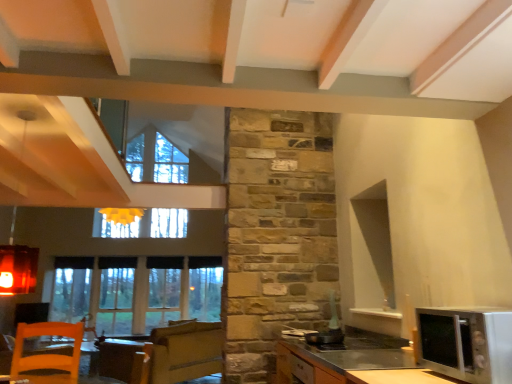
Question: Is satin silver microwave at lower right located within silver metallic microwave at lower right?

Choices:
 (A) no
 (B) yes

Answer: (A)

Question: Considering the relative sizes of silver metallic microwave at lower right and satin silver microwave at lower right in the image provided, is silver metallic microwave at lower right shorter than satin silver microwave at lower right?

Choices:
 (A) yes
 (B) no

Answer: (A)

Question: From a real-world perspective, is silver metallic microwave at lower right located higher than satin silver microwave at lower right?

Choices:
 (A) no
 (B) yes

Answer: (B)

Question: Can you confirm if silver metallic microwave at lower right is thinner than satin silver microwave at lower right?

Choices:
 (A) no
 (B) yes

Answer: (B)

Question: From the image's perspective, is silver metallic microwave at lower right located beneath satin silver microwave at lower right?

Choices:
 (A) no
 (B) yes

Answer: (A)

Question: From the image's perspective, is silver metallic microwave at lower right located above satin silver microwave at lower right?

Choices:
 (A) yes
 (B) no

Answer: (A)

Question: Can you confirm if satin silver microwave at lower right is shorter than clear glass window at lower left?

Choices:
 (A) yes
 (B) no

Answer: (A)

Question: Can you confirm if satin silver microwave at lower right is smaller than clear glass window at lower left?

Choices:
 (A) no
 (B) yes

Answer: (B)

Question: Is satin silver microwave at lower right facing away from clear glass window at lower left?

Choices:
 (A) no
 (B) yes

Answer: (A)

Question: Does satin silver microwave at lower right appear on the left side of clear glass window at lower left?

Choices:
 (A) no
 (B) yes

Answer: (A)

Question: From a real-world perspective, is satin silver microwave at lower right positioned over clear glass window at lower left based on gravity?

Choices:
 (A) yes
 (B) no

Answer: (B)

Question: Can you confirm if satin silver microwave at lower right is thinner than clear glass window at lower left?

Choices:
 (A) no
 (B) yes

Answer: (A)

Question: Is silver metallic microwave at lower right aimed at clear glass window at lower left?

Choices:
 (A) no
 (B) yes

Answer: (A)